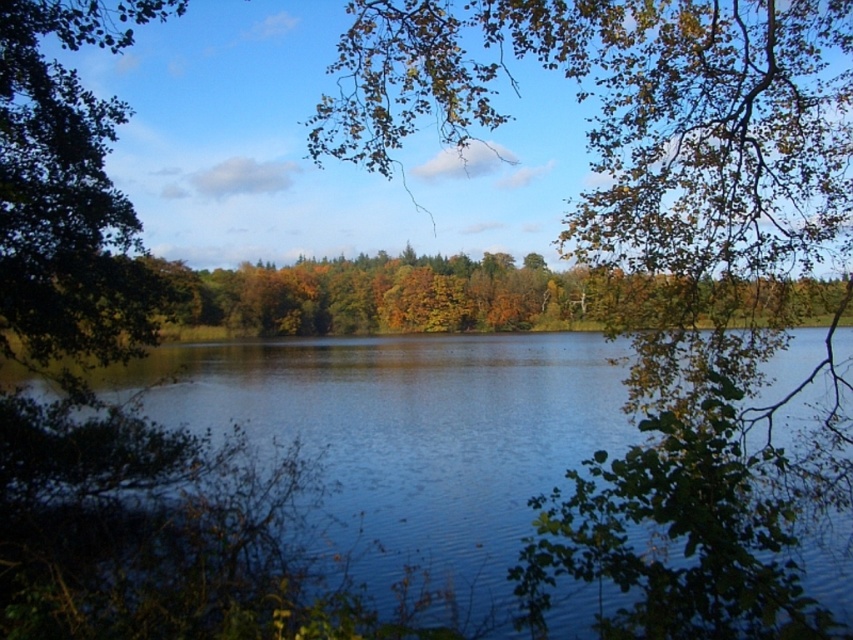
Question: Is blue liquid water at center bigger than green leafy tree at left?

Choices:
 (A) no
 (B) yes

Answer: (B)

Question: Does blue liquid water at center have a greater width compared to green leafy tree at left?

Choices:
 (A) no
 (B) yes

Answer: (B)

Question: Which point appears farthest from the camera in this image?

Choices:
 (A) (42, 282)
 (B) (595, 362)

Answer: (B)

Question: Is blue liquid water at center positioned at the back of green leafy tree at left?

Choices:
 (A) no
 (B) yes

Answer: (A)